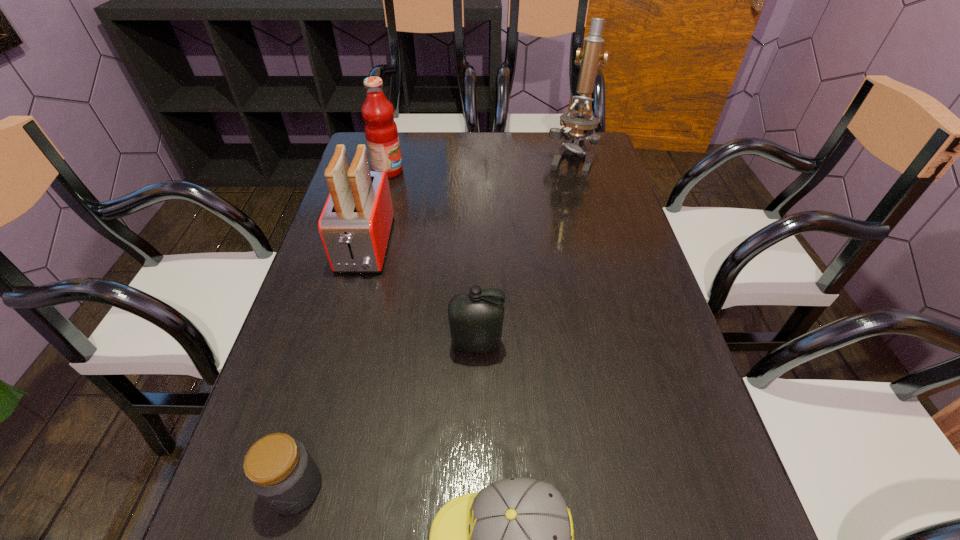
Find the location of a particular element. the tallest object is located at coordinates (582, 123).

Find the location of `the rightmost object`. the rightmost object is located at coordinates (582, 123).

What are the coordinates of `fruit juice` in the screenshot? It's located at [381, 132].

Find the location of a particular element. This screenshot has height=540, width=960. the fourth nearest object is located at coordinates (355, 225).

What are the coordinates of `the third nearest object` in the screenshot? It's located at (476, 318).

What are the coordinates of `the fourth tallest object` in the screenshot? It's located at (476, 318).

This screenshot has height=540, width=960. I want to click on jar, so click(279, 469).

Locate an element on the screen. free spot located on the front of the tallest object is located at coordinates (591, 241).

Find the location of `free region located 0.340m on the front label of the fruit juice`. free region located 0.340m on the front label of the fruit juice is located at coordinates (513, 171).

This screenshot has height=540, width=960. I want to click on free space located on the front-facing side of the third farthest object, so click(343, 328).